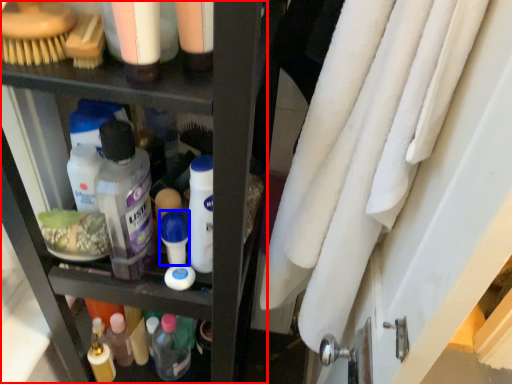
Question: Which of the following is the closest to the observer, shelf (highlighted by a red box) or toiletry (highlighted by a blue box)?

Choices:
 (A) shelf
 (B) toiletry

Answer: (A)